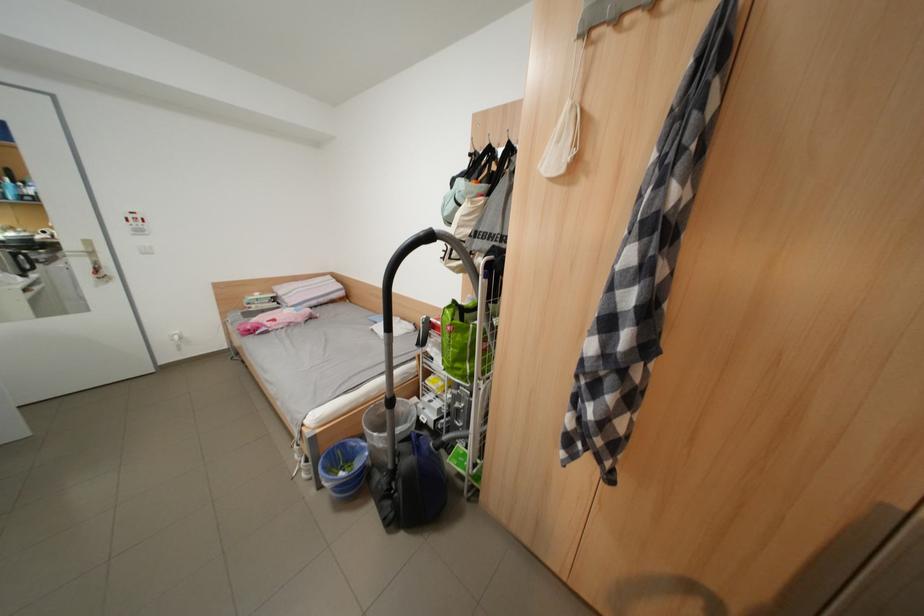
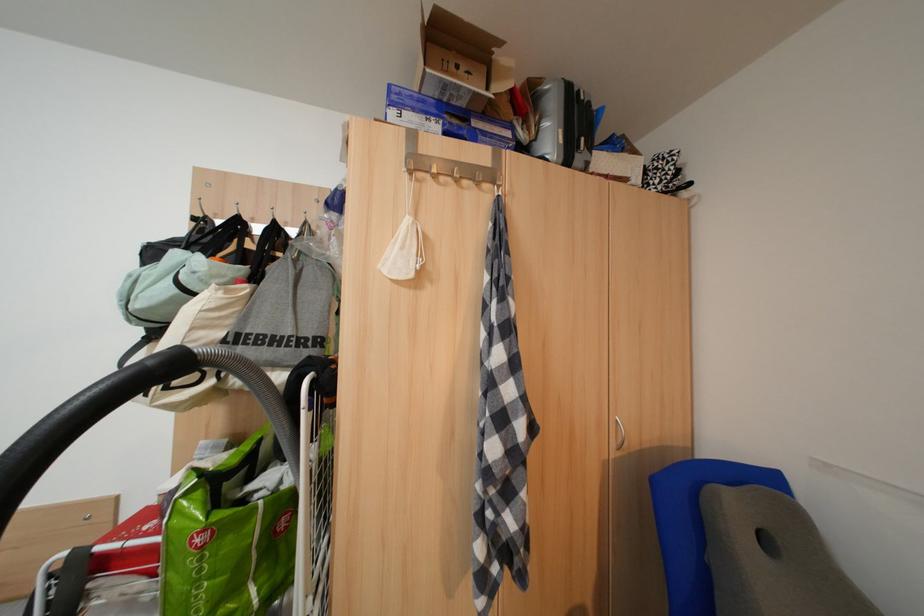
Question: The first image is from the beginning of the video and the second image is from the end. How did the camera likely rotate when shooting the video?

Choices:
 (A) Left
 (B) Right
 (C) Up
 (D) Down

Answer: (B)